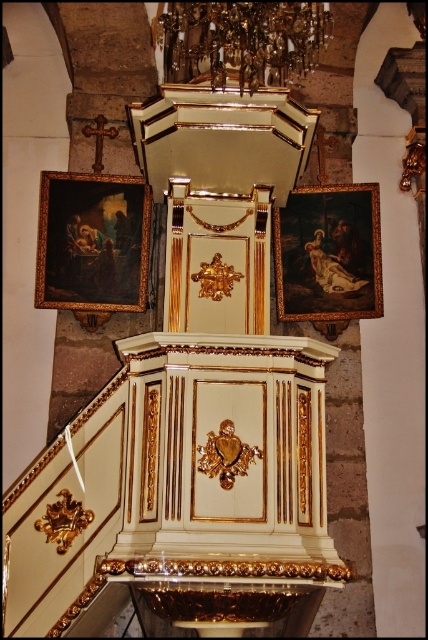
Does point (109, 310) lie behind point (323, 273)?

No, (109, 310) is closer to viewer.

Who is positioned more to the left, oil painting at left or wooden dark painting at right?

Positioned to the left is oil painting at left.

This screenshot has width=428, height=640. I want to click on oil painting at left, so click(x=92, y=243).